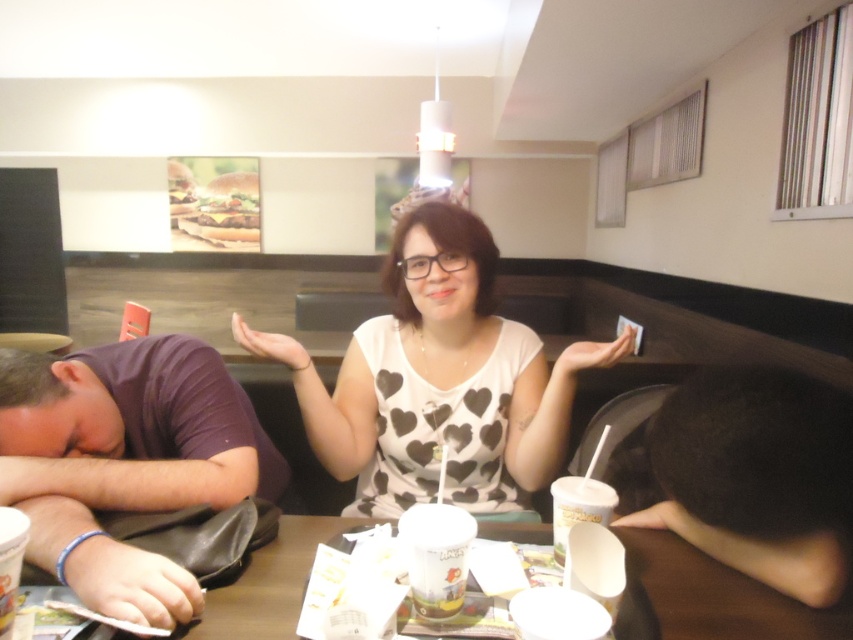
Between brown paper table at center and white paper cup at center, which one appears on the left side from the viewer's perspective?

white paper cup at center is more to the left.

Does brown paper table at center appear over white paper cup at center?

No.

Where is `brown paper table at center`? The width and height of the screenshot is (853, 640). brown paper table at center is located at coordinates (711, 596).

Can you confirm if dark brown hair at lower right is positioned to the left of white paper cup at lower center?

No, dark brown hair at lower right is not to the left of white paper cup at lower center.

Who is higher up, dark brown hair at lower right or white paper cup at lower center?

Positioned higher is dark brown hair at lower right.

Between point (752, 369) and point (589, 515), which one is positioned in front?

Positioned in front is point (752, 369).

Image resolution: width=853 pixels, height=640 pixels. I want to click on dark brown hair at lower right, so click(x=757, y=476).

You are a GUI agent. You are given a task and a screenshot of the screen. Output one action in this format:
    pyautogui.click(x=<x>, y=<y>)
    Task: Click on the purple fabric shirt at left
    
    Given the screenshot: What is the action you would take?
    pyautogui.click(x=126, y=461)

Does purple fabric shirt at left appear under white paper cup at center?

Actually, purple fabric shirt at left is above white paper cup at center.

The width and height of the screenshot is (853, 640). Describe the element at coordinates (126, 461) in the screenshot. I see `purple fabric shirt at left` at that location.

Identify the location of purple fabric shirt at left. (126, 461).